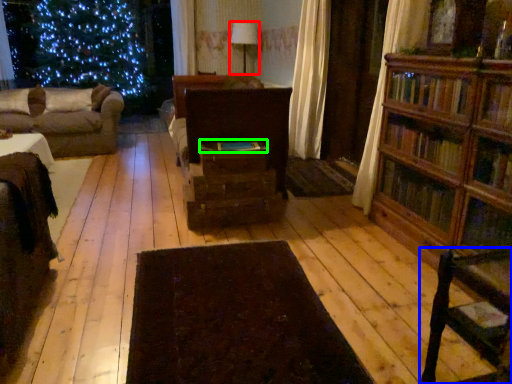
Question: Considering the real-world distances, which object is farthest from lamp (highlighted by a red box)? chair (highlighted by a blue box) or book (highlighted by a green box)?

Choices:
 (A) chair
 (B) book

Answer: (A)